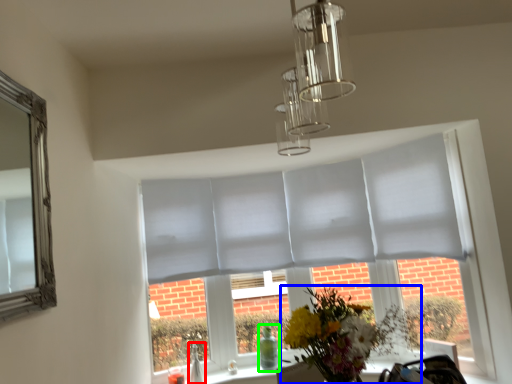
Question: Which is nearer to the glass vase (highlighted by a red box)? flower (highlighted by a blue box) or glass vase (highlighted by a green box).

Choices:
 (A) flower
 (B) glass vase

Answer: (B)